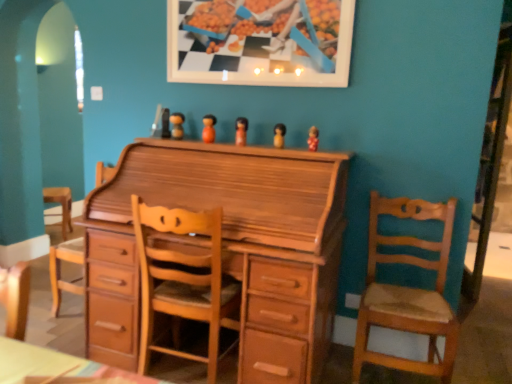
Where is `free space in front of orange matte wooden doll at center, which is the second toy in left-to-right order`? The width and height of the screenshot is (512, 384). free space in front of orange matte wooden doll at center, which is the second toy in left-to-right order is located at coordinates (210, 144).